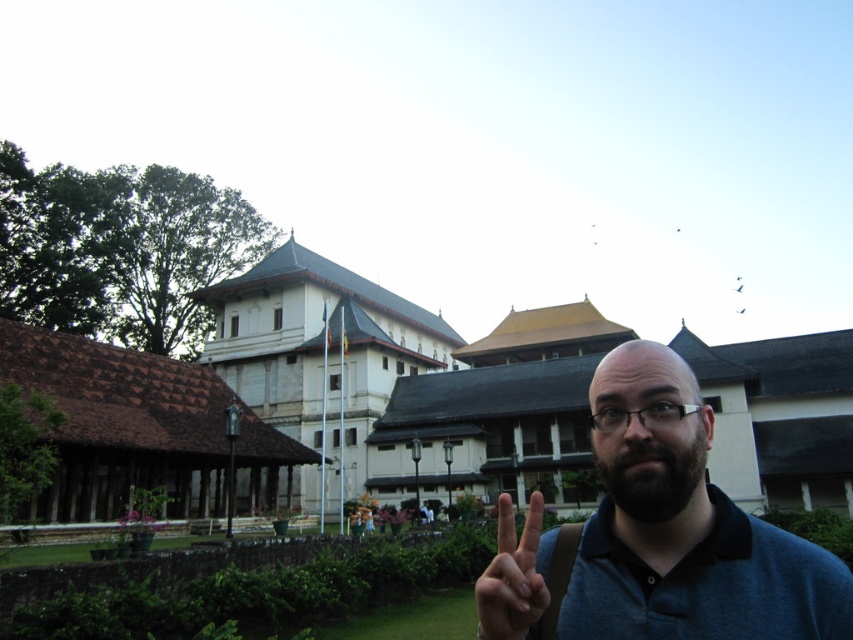
What do you see at coordinates (683, 528) in the screenshot?
I see `dark blue shirt at center` at bounding box center [683, 528].

Which is in front, point (537, 513) or point (297, 339)?

Positioned in front is point (537, 513).

In order to click on dark blue shirt at center in this screenshot , I will do `click(683, 528)`.

Who is taller, dark blue shirt at center or brown tiled roof at lower left?

Standing taller between the two is brown tiled roof at lower left.

Does dark blue shirt at center have a smaller size compared to brown tiled roof at lower left?

Correct, dark blue shirt at center occupies less space than brown tiled roof at lower left.

Measure the distance between dark blue shirt at center and camera.

A distance of 18.28 meters exists between dark blue shirt at center and camera.

Locate an element on the screen. dark blue shirt at center is located at coordinates click(x=683, y=528).

Can you confirm if dark blue shirt at center is shorter than matte skin hand at center?

No.

Is dark blue shirt at center bigger than matte skin hand at center?

Correct, dark blue shirt at center is larger in size than matte skin hand at center.

Does point (734, 605) come closer to viewer compared to point (521, 576)?

No.

Find the location of `dark blue shirt at center`. dark blue shirt at center is located at coordinates (683, 528).